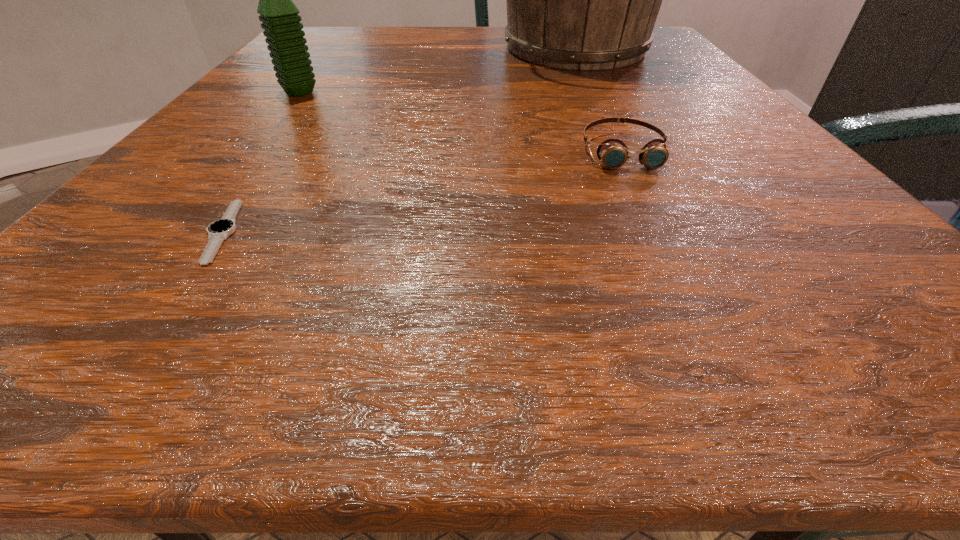
Where is `bucket`? bucket is located at coordinates (587, 0).

Find the location of a particular element. This screenshot has width=960, height=540. the tallest object is located at coordinates (587, 0).

Locate an element on the screen. Image resolution: width=960 pixels, height=540 pixels. the third nearest object is located at coordinates (281, 23).

In order to click on water bottle in this screenshot , I will do `click(281, 23)`.

You are a GUI agent. You are given a task and a screenshot of the screen. Output one action in this format:
    pyautogui.click(x=<x>, y=<y>)
    Task: Click on the goggles
    The height and width of the screenshot is (540, 960).
    Given the screenshot: What is the action you would take?
    pyautogui.click(x=613, y=153)

This screenshot has height=540, width=960. I want to click on the third farthest object, so click(613, 153).

Identify the location of the shortest object. Image resolution: width=960 pixels, height=540 pixels. (218, 231).

This screenshot has width=960, height=540. Identify the location of the nearest object. (218, 231).

At what (x,y) coordinates should I click in order to perform the action: click on free spot located on the handle side of the bucket. Please return your answer as a coordinate pair (x, y). The width and height of the screenshot is (960, 540). Looking at the image, I should click on (619, 131).

Find the location of a particular element. This screenshot has width=960, height=540. free region located on the right of the second farthest object is located at coordinates (451, 92).